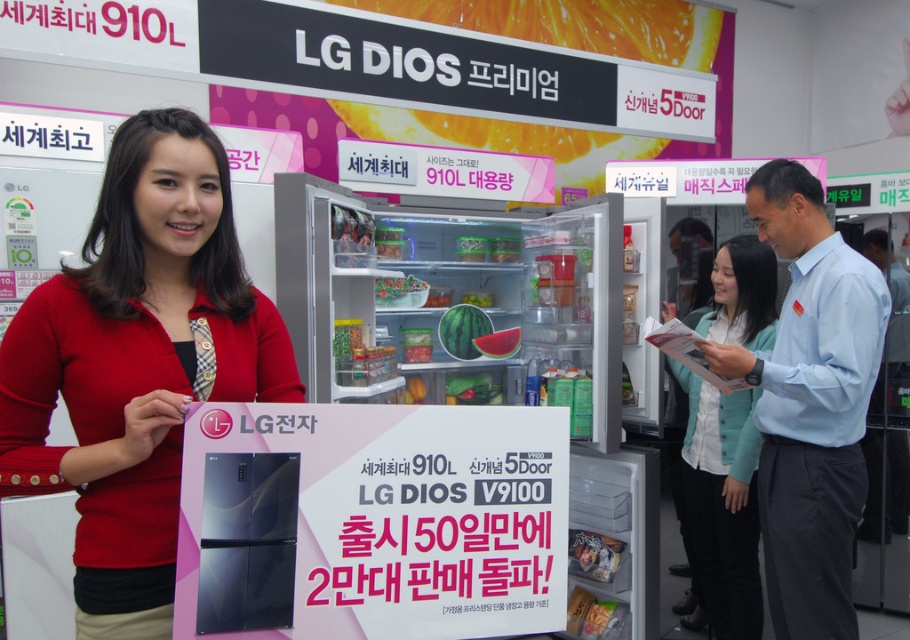
Between matte black refrigerator at left and translucent plastic container at center, which one appears on the left side from the viewer's perspective?

From the viewer's perspective, matte black refrigerator at left appears more on the left side.

Can you confirm if matte black refrigerator at left is taller than translucent plastic container at center?

Yes, matte black refrigerator at left is taller than translucent plastic container at center.

Which is in front, point (205, 352) or point (623, 550)?

Point (205, 352) is more forward.

Locate an element on the screen. The width and height of the screenshot is (910, 640). matte black refrigerator at left is located at coordinates (137, 364).

Does light blue shirt at upper right have a smaller size compared to light blue fabric jacket at center?

Yes, light blue shirt at upper right is smaller than light blue fabric jacket at center.

Find the location of a particular element. light blue shirt at upper right is located at coordinates (810, 404).

Which is more to the left, matte black refrigerator at left or light blue shirt at upper right?

From the viewer's perspective, matte black refrigerator at left appears more on the left side.

Is matte black refrigerator at left to the right of light blue shirt at upper right from the viewer's perspective?

Incorrect, matte black refrigerator at left is not on the right side of light blue shirt at upper right.

Which is behind, point (56, 477) or point (775, 468)?

Positioned behind is point (775, 468).

Identify the location of matte black refrigerator at left. (137, 364).